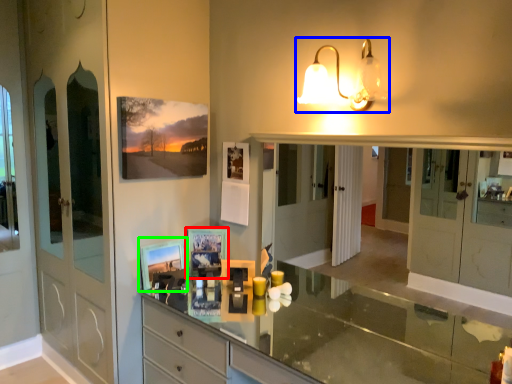
Question: Which is nearer to the picture frame (highlighted by a red box)? lamp (highlighted by a blue box) or picture frame (highlighted by a green box).

Choices:
 (A) lamp
 (B) picture frame

Answer: (B)